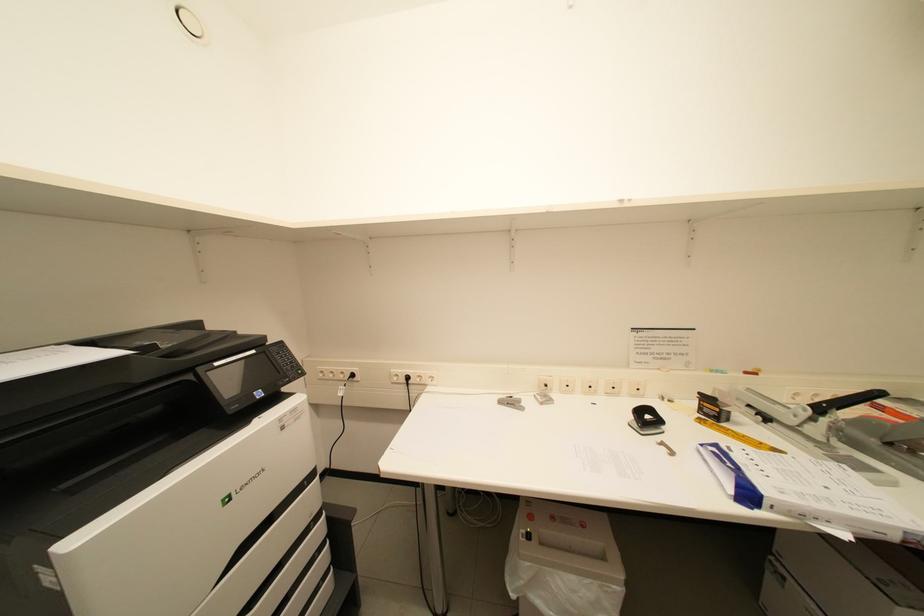
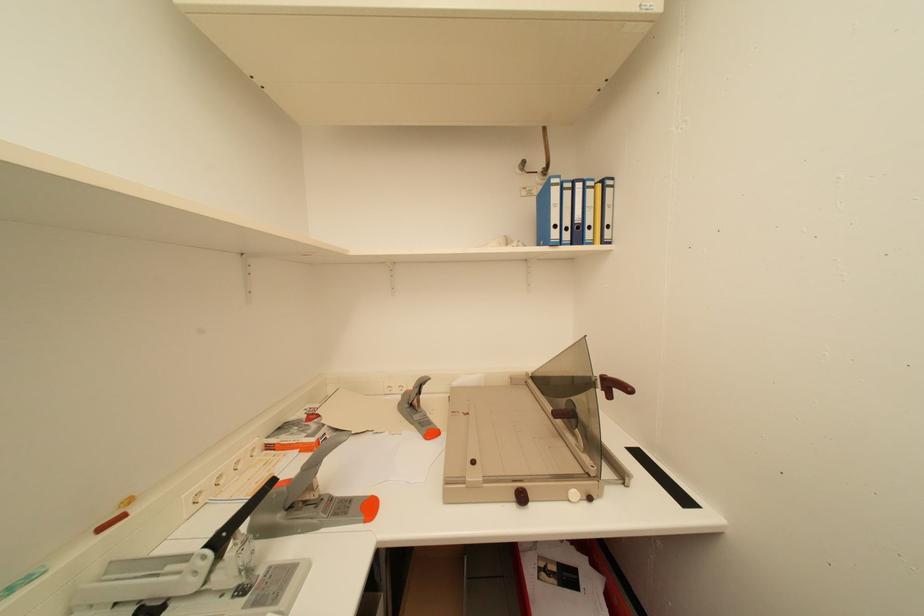
Question: The camera is either moving clockwise (left) or counter-clockwise (right) around the object. The first image is from the beginning of the video and the second image is from the end. Is the camera moving left or right when shooting the video?

Choices:
 (A) Left
 (B) Right

Answer: (A)